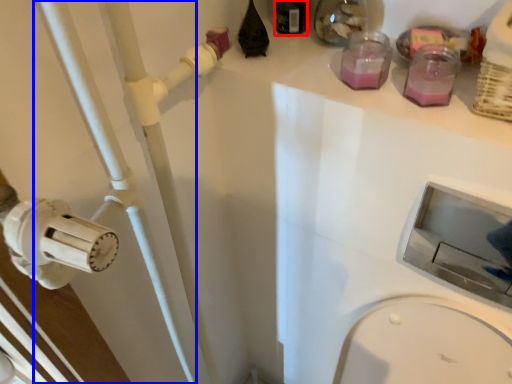
Question: Which point is further to the camera, bottle (highlighted by a red box) or pipe (highlighted by a blue box)?

Choices:
 (A) bottle
 (B) pipe

Answer: (A)